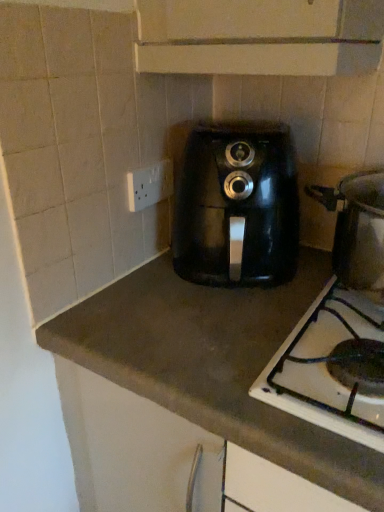
Question: Is the depth of white plastic socket at upper left less than that of black matte gas stove at lower right?

Choices:
 (A) yes
 (B) no

Answer: (B)

Question: Is white plastic socket at upper left not inside black matte gas stove at lower right?

Choices:
 (A) no
 (B) yes

Answer: (B)

Question: From the image's perspective, is white plastic socket at upper left over black matte gas stove at lower right?

Choices:
 (A) yes
 (B) no

Answer: (A)

Question: Is white plastic socket at upper left not close to black matte gas stove at lower right?

Choices:
 (A) yes
 (B) no

Answer: (B)

Question: Considering the relative positions of white plastic socket at upper left and black matte gas stove at lower right in the image provided, is white plastic socket at upper left to the left of black matte gas stove at lower right from the viewer's perspective?

Choices:
 (A) no
 (B) yes

Answer: (B)

Question: Can you confirm if white plastic socket at upper left is positioned to the right of black matte gas stove at lower right?

Choices:
 (A) no
 (B) yes

Answer: (A)

Question: Is black matte gas stove at lower right to the right of white plastic socket at upper left from the viewer's perspective?

Choices:
 (A) no
 (B) yes

Answer: (B)

Question: Can you confirm if black matte gas stove at lower right is wider than white plastic socket at upper left?

Choices:
 (A) yes
 (B) no

Answer: (A)

Question: Is black matte gas stove at lower right aimed at white plastic socket at upper left?

Choices:
 (A) no
 (B) yes

Answer: (A)

Question: Does black matte gas stove at lower right have a lesser width compared to white plastic socket at upper left?

Choices:
 (A) yes
 (B) no

Answer: (B)

Question: From the image's perspective, does black matte gas stove at lower right appear higher than white plastic socket at upper left?

Choices:
 (A) yes
 (B) no

Answer: (B)

Question: Is black matte gas stove at lower right placed right next to white plastic socket at upper left?

Choices:
 (A) no
 (B) yes

Answer: (A)

Question: Considering the relative sizes of black matte gas stove at lower right and brown matte countertop at center in the image provided, is black matte gas stove at lower right thinner than brown matte countertop at center?

Choices:
 (A) yes
 (B) no

Answer: (B)